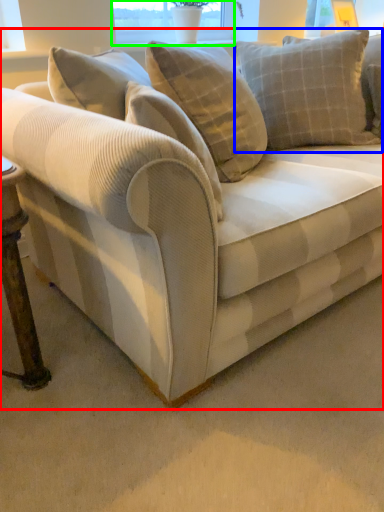
Question: Which object is positioned farthest from studio couch (highlighted by a red box)? Select from pillow (highlighted by a blue box) and window screen (highlighted by a green box).

Choices:
 (A) pillow
 (B) window screen

Answer: (B)